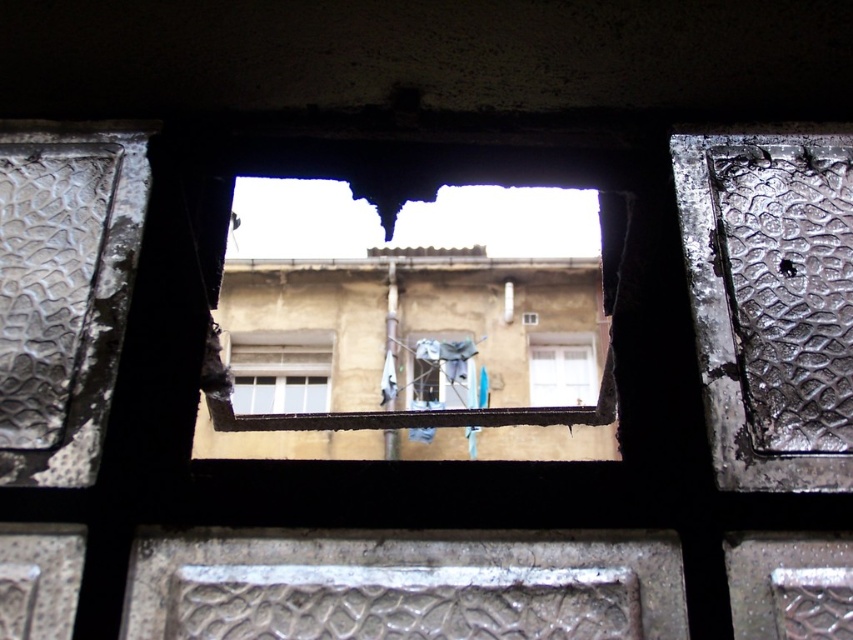
You are an architect designing a new building and want to ensure proper ventilation. You have two windows, a white matte window at center and a white plastic window at center. According to the scene, which window is located to the left of the other?

The white matte window at center is positioned on the left side of the white plastic window at center, so the white matte window at center is to the left of the white plastic window at center.

You are a painter standing at the opening in the wall. You want to paint both the white matte window at center and the beige building behind it. Which one should you focus on first if you want to paint objects closer to you?

You should focus on the white matte window at center first because it is closer to you than the beige building behind it.

You are standing in front of the rectangular opening in the wall. There are two points marked on the wall inside the opening. The first point is at coordinate point (x=262, y=380) and the second is at point (x=589, y=349). If you want to touch both points starting from the nearest one, which point should you touch first?

You should touch point (x=262, y=380) first because it is closer to you than point (x=589, y=349).